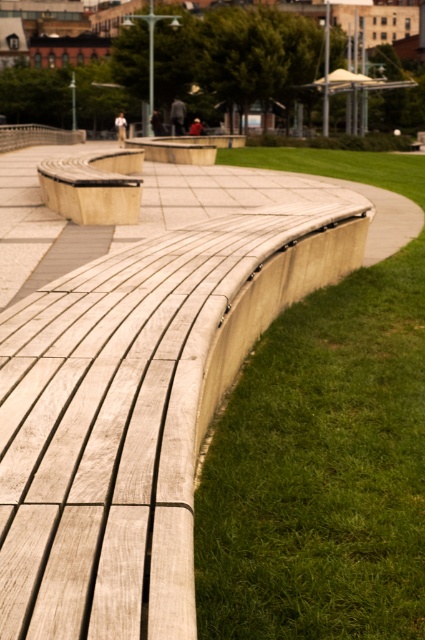
Which of these two, green grass at lower right or wooden bench at center, stands taller?

wooden bench at center

Who is positioned more to the right, green grass at lower right or wooden bench at center?

From the viewer's perspective, green grass at lower right appears more on the right side.

Between point (410, 500) and point (110, 172), which one is positioned behind?

Point (110, 172)

Locate an element on the screen. The width and height of the screenshot is (425, 640). green grass at lower right is located at coordinates (322, 470).